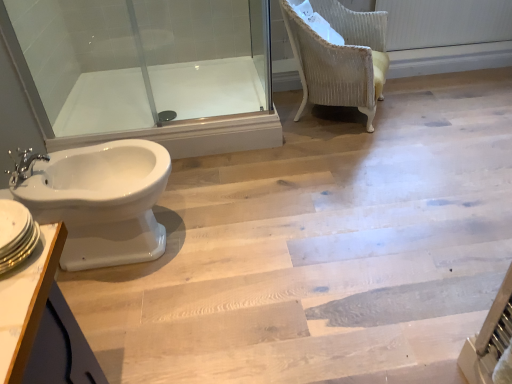
Find the location of `vacant space underneath velvet yellow chair at upper right (from a real-world perspective)`. vacant space underneath velvet yellow chair at upper right (from a real-world perspective) is located at coordinates (335, 118).